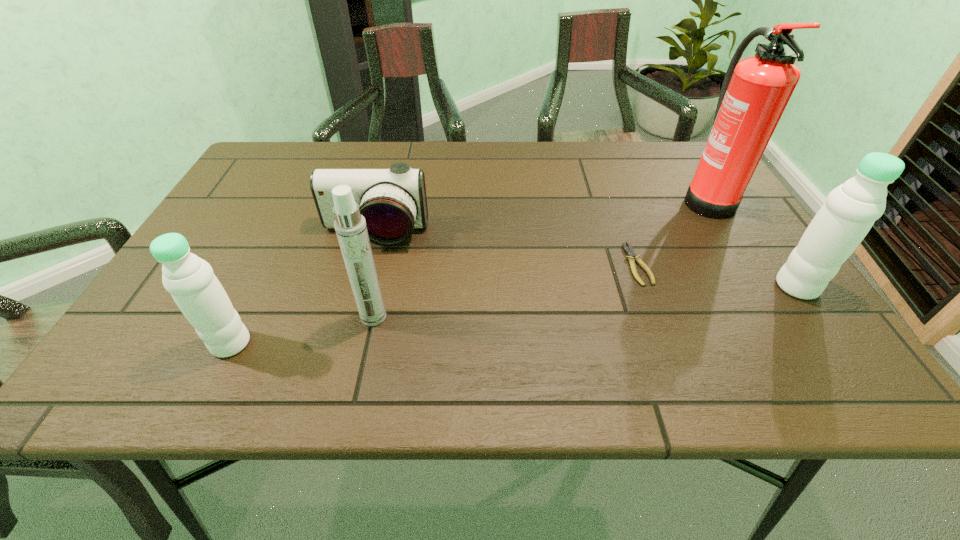
The image size is (960, 540). Find the location of `the third shortest object`. the third shortest object is located at coordinates (190, 280).

Find the location of a particular element. the shorter water bottle is located at coordinates (190, 280).

What are the coordinates of `the taller water bottle` in the screenshot? It's located at (850, 210).

You are a GUI agent. You are given a task and a screenshot of the screen. Output one action in this format:
    pyautogui.click(x=<x>, y=<y>)
    Task: Click on the farther water bottle
    The image size is (960, 540).
    Given the screenshot: What is the action you would take?
    pyautogui.click(x=850, y=210)

At what (x,y) coordinates should I click in order to perform the action: click on camcorder. Please return your answer as a coordinate pair (x, y). Looking at the image, I should click on coord(393,201).

Identify the location of pliers. (632, 257).

Identify the location of the fourth object from left to right. (632, 257).

Identify the location of the tallest object. This screenshot has width=960, height=540. 755,92.

Identify the location of the fifth farthest object. (350, 226).

Identify the location of vacant space located 0.290m on the right of the nearer water bottle. (406, 343).